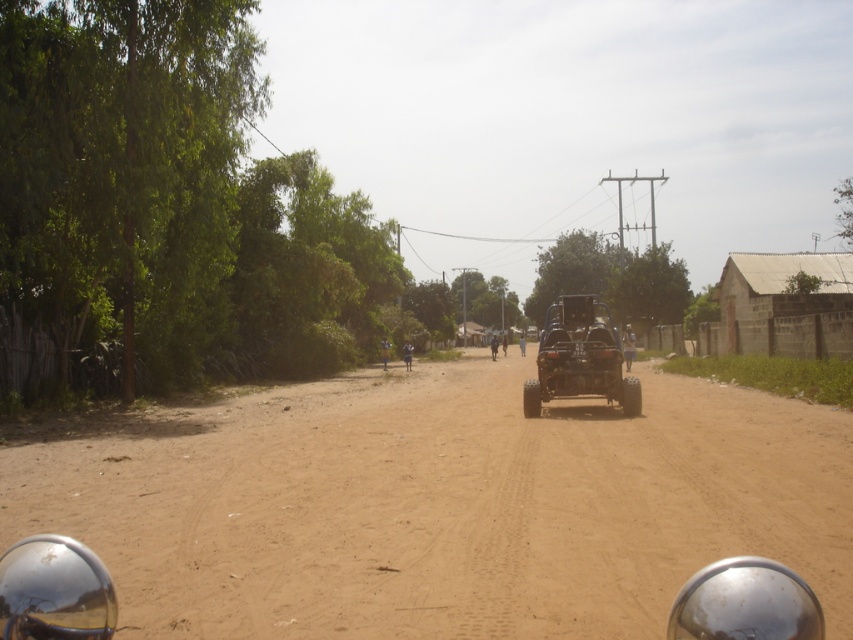
You are a delivery drone operator. Your drone needs to fly over the black matte jeep at center and the blue fabric motorcyclist at center to deliver a package. Considering their heights, which object should the drone avoid hitting by flying higher?

The black matte jeep at center has a greater height compared to the blue fabric motorcyclist at center, so the drone should fly higher to avoid hitting the black matte jeep at center.

You are driving a black matte jeep at center on a rural dirt road. You need to stop before reaching the brown sandy dirt at center. Is the jeep currently behind the sandy dirt?

The brown sandy dirt at center is in front of the black matte jeep at center, so the jeep is behind the sandy dirt and can stop before reaching it.